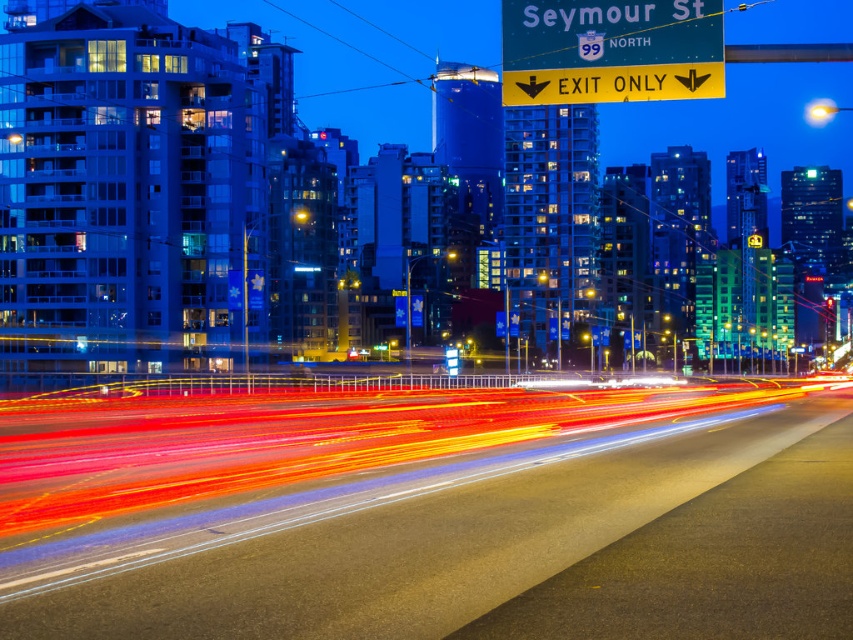
From the picture: You are standing at the point closest to the viewer in the image. Which of the two points, point (315, 406) or point (675, 26), is farther away from you?

Point (315, 406) is farther away from you because it is behind point (675, 26), which is closer to the viewer.

You are driving a car and see the metallic asphalt highway at center and the yellow plastic sign at upper center. Which object is located to the right side from your perspective?

The metallic asphalt highway at center is to the right of the yellow plastic sign at upper center, so the metallic asphalt highway at center is located to the right side from your perspective.

You are a drone operator planning to fly a drone from the yellow plastic sign at upper center to the metallic asphalt highway at center. The drone has a maximum flight distance of 7 meters. Can the drone safely reach the highway from the sign?

The metallic asphalt highway at center is 7.38 meters from the yellow plastic sign at upper center, which exceeds the drone maximum flight distance of 7 meters. The drone cannot safely reach the highway from the sign.